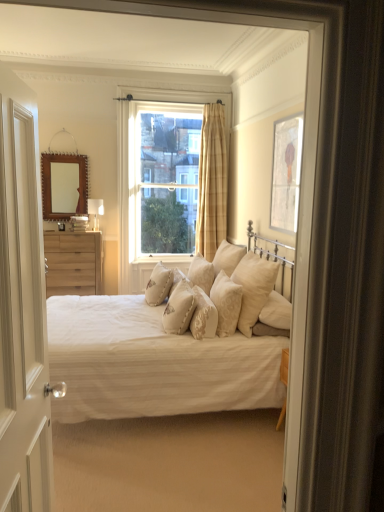
Question: Is natural wood chest of drawers at left shorter than beige textured pillow at center, the 3th pillow from the left?

Choices:
 (A) no
 (B) yes

Answer: (A)

Question: Is natural wood chest of drawers at left positioned far away from beige textured pillow at center, the 5th pillow in the right-to-left sequence?

Choices:
 (A) no
 (B) yes

Answer: (B)

Question: Does natural wood chest of drawers at left have a larger size compared to beige textured pillow at center, the 3th pillow from the left?

Choices:
 (A) no
 (B) yes

Answer: (B)

Question: From a real-world perspective, is natural wood chest of drawers at left located beneath beige textured pillow at center, the 5th pillow in the right-to-left sequence?

Choices:
 (A) no
 (B) yes

Answer: (B)

Question: Is natural wood chest of drawers at left wider than beige textured pillow at center, the 5th pillow in the right-to-left sequence?

Choices:
 (A) no
 (B) yes

Answer: (B)

Question: From the image's perspective, is natural wood chest of drawers at left beneath beige textured pillow at center, the 3th pillow from the left?

Choices:
 (A) yes
 (B) no

Answer: (B)

Question: Considering the relative positions of beige textured pillow at center, arranged as the fifth pillow when viewed from the left, and natural wood chest of drawers at left in the image provided, is beige textured pillow at center, arranged as the fifth pillow when viewed from the left, to the left of natural wood chest of drawers at left from the viewer's perspective?

Choices:
 (A) no
 (B) yes

Answer: (A)

Question: Is beige textured pillow at center, which is the third pillow in right-to-left order, next to natural wood chest of drawers at left?

Choices:
 (A) no
 (B) yes

Answer: (A)

Question: Does beige textured pillow at center, arranged as the fifth pillow when viewed from the left, appear on the right side of natural wood chest of drawers at left?

Choices:
 (A) yes
 (B) no

Answer: (A)

Question: Can you confirm if beige textured pillow at center, arranged as the fifth pillow when viewed from the left, is taller than natural wood chest of drawers at left?

Choices:
 (A) yes
 (B) no

Answer: (B)

Question: Is beige textured pillow at center, which is the third pillow in right-to-left order, smaller than natural wood chest of drawers at left?

Choices:
 (A) yes
 (B) no

Answer: (A)

Question: Is beige textured pillow at center, which is the third pillow in right-to-left order, not close to natural wood chest of drawers at left?

Choices:
 (A) no
 (B) yes

Answer: (B)

Question: Is there a large distance between clear glass window at center and beige fabric pillow at center, which is the seventh pillow from left to right?

Choices:
 (A) no
 (B) yes

Answer: (B)